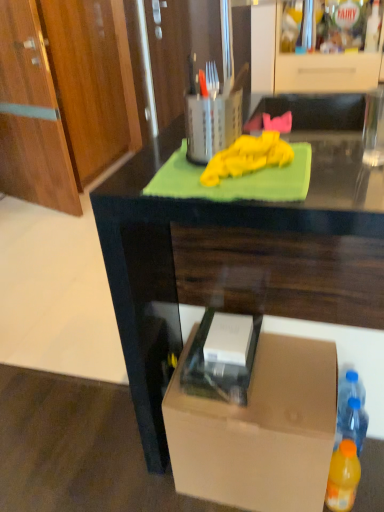
This screenshot has width=384, height=512. Find the location of `metallic silver utensil holder at upper center`. metallic silver utensil holder at upper center is located at coordinates (211, 124).

This screenshot has width=384, height=512. What do you see at coordinates (232, 261) in the screenshot?
I see `dark wood desk at center` at bounding box center [232, 261].

Measure the distance between point (107, 231) and camera.

Point (107, 231) is 33.50 inches away from camera.

Image resolution: width=384 pixels, height=512 pixels. What are the coordinates of `blue plastic bottle at lower right, acting as the 2th bottle starting from the front` in the screenshot? It's located at (351, 411).

Does point (218, 141) come farther from viewer compared to point (360, 382)?

No, it is in front of (360, 382).

Considering the positions of objects metallic silver utensil holder at upper center and blue plastic bottle at lower right, which ranks as the first bottle in back-to-front order, in the image provided, who is more to the left, metallic silver utensil holder at upper center or blue plastic bottle at lower right, which ranks as the first bottle in back-to-front order,?

metallic silver utensil holder at upper center is more to the left.

Is metallic silver utensil holder at upper center in contact with blue plastic bottle at lower right, acting as the 2th bottle starting from the front?

No, metallic silver utensil holder at upper center is not next to blue plastic bottle at lower right, acting as the 2th bottle starting from the front.

From a real-world perspective, is metallic silver utensil holder at upper center over blue plastic bottle at lower right, which ranks as the first bottle in back-to-front order?

Yes, from a real-world perspective, metallic silver utensil holder at upper center is over blue plastic bottle at lower right, which ranks as the first bottle in back-to-front order

Considering the relative sizes of brown cardboard box at lower right and matte wood cabinet at upper center in the image provided, is brown cardboard box at lower right wider than matte wood cabinet at upper center?

No, brown cardboard box at lower right is not wider than matte wood cabinet at upper center.

Is brown cardboard box at lower right positioned in front of matte wood cabinet at upper center?

Yes, the depth of brown cardboard box at lower right is less than that of matte wood cabinet at upper center.

Considering the relative sizes of brown cardboard box at lower right and matte wood cabinet at upper center in the image provided, is brown cardboard box at lower right taller than matte wood cabinet at upper center?

Incorrect, the height of brown cardboard box at lower right is not larger of that of matte wood cabinet at upper center.

Looking at this image, are matte wood cabinet at upper center and metallic silver utensil holder at upper center beside each other?

matte wood cabinet at upper center is not next to metallic silver utensil holder at upper center, and they're not touching.

From a real-world perspective, does matte wood cabinet at upper center sit lower than metallic silver utensil holder at upper center?

Yes, from a real-world perspective, matte wood cabinet at upper center is under metallic silver utensil holder at upper center.

How many degrees apart are the facing directions of matte wood cabinet at upper center and metallic silver utensil holder at upper center?

91 degrees.

Is matte wood cabinet at upper center positioned before metallic silver utensil holder at upper center?

No, matte wood cabinet at upper center is further to the viewer.

From the image's perspective, between matte wood cabinet at upper center and blue plastic bottle at lower right, which ranks as the first bottle in back-to-front order, who is located below?

From the image's view, blue plastic bottle at lower right, which ranks as the first bottle in back-to-front order, is below.

Does matte wood cabinet at upper center appear on the right side of blue plastic bottle at lower right, acting as the 2th bottle starting from the front?

Yes, matte wood cabinet at upper center is to the right of blue plastic bottle at lower right, acting as the 2th bottle starting from the front.

Is matte wood cabinet at upper center with blue plastic bottle at lower right, which ranks as the first bottle in back-to-front order?

matte wood cabinet at upper center is not next to blue plastic bottle at lower right, which ranks as the first bottle in back-to-front order, and they're not touching.

Is point (278, 41) closer or farther from the camera than point (345, 393)?

Point (278, 41) is farther from the camera than point (345, 393).

Considering the points (334, 475) and (147, 151), which point is behind, point (334, 475) or point (147, 151)?

Point (334, 475)

From the image's perspective, is orange plastic bottle at lower right, placed as the second bottle when sorted from back to front, located beneath dark wood desk at center?

Yes, from the image's perspective, orange plastic bottle at lower right, placed as the second bottle when sorted from back to front, is below dark wood desk at center.

From the image's perspective, which bottle is the 2nd one below the dark wood desk at center? Please provide its 2D coordinates.

[(343, 477)]

From a real-world perspective, is orange plastic bottle at lower right, placed as the second bottle when sorted from back to front, on dark wood desk at center?

No, from a real-world perspective, orange plastic bottle at lower right, placed as the second bottle when sorted from back to front, is not over dark wood desk at center

Is blue plastic bottle at lower right, acting as the 2th bottle starting from the front, at the back of orange plastic bottle at lower right, positioned as the 1th bottle in front-to-back order?

Absolutely, orange plastic bottle at lower right, positioned as the 1th bottle in front-to-back order, is directed away from blue plastic bottle at lower right, acting as the 2th bottle starting from the front.

Considering the relative sizes of orange plastic bottle at lower right, placed as the second bottle when sorted from back to front, and blue plastic bottle at lower right, which ranks as the first bottle in back-to-front order, in the image provided, is orange plastic bottle at lower right, placed as the second bottle when sorted from back to front, shorter than blue plastic bottle at lower right, which ranks as the first bottle in back-to-front order,?

No.

Which is in front, orange plastic bottle at lower right, placed as the second bottle when sorted from back to front, or blue plastic bottle at lower right, which ranks as the first bottle in back-to-front order?

orange plastic bottle at lower right, placed as the second bottle when sorted from back to front, is closer to the camera.

From the image's perspective, is orange plastic bottle at lower right, placed as the second bottle when sorted from back to front, on blue plastic bottle at lower right, which ranks as the first bottle in back-to-front order?

No.

From the picture: Can we say blue plastic bottle at lower right, acting as the 2th bottle starting from the front, lies outside brown cardboard box at lower right?

Yes, blue plastic bottle at lower right, acting as the 2th bottle starting from the front, is located beyond the bounds of brown cardboard box at lower right.

Between blue plastic bottle at lower right, acting as the 2th bottle starting from the front, and brown cardboard box at lower right, which one has smaller size?

blue plastic bottle at lower right, acting as the 2th bottle starting from the front.

Is blue plastic bottle at lower right, acting as the 2th bottle starting from the front, positioned in front of brown cardboard box at lower right?

No, blue plastic bottle at lower right, acting as the 2th bottle starting from the front, is further to the viewer.

There is a blue plastic bottle at lower right, acting as the 2th bottle starting from the front. Identify the location of appliance above it (from a real-world perspective). This screenshot has width=384, height=512. (211, 124).

I want to click on cabinetry above the brown cardboard box at lower right (from the image's perspective), so click(324, 70).

Looking at the image, which one is located further to orange plastic bottle at lower right, placed as the second bottle when sorted from back to front, brown cardboard box at lower right or dark wood desk at center?

dark wood desk at center is positioned further to the anchor orange plastic bottle at lower right, placed as the second bottle when sorted from back to front.

From the picture: Based on their spatial positions, is metallic silver utensil holder at upper center or blue plastic bottle at lower right, which ranks as the first bottle in back-to-front order, closer to matte wood cabinet at upper center?

Among the two, metallic silver utensil holder at upper center is located nearer to matte wood cabinet at upper center.

Which object lies nearer to the anchor point metallic silver utensil holder at upper center, brown cardboard box at lower right or orange plastic bottle at lower right, placed as the second bottle when sorted from back to front?

The object closer to metallic silver utensil holder at upper center is brown cardboard box at lower right.

From the image, which object appears to be nearer to dark wood desk at center, orange plastic bottle at lower right, positioned as the 1th bottle in front-to-back order, or matte wood cabinet at upper center?

orange plastic bottle at lower right, positioned as the 1th bottle in front-to-back order, is positioned closer to the anchor dark wood desk at center.

Looking at the image, which one is located further to brown cardboard box at lower right, metallic silver utensil holder at upper center or dark wood desk at center?

Among the two, metallic silver utensil holder at upper center is located further to brown cardboard box at lower right.

Looking at the image, which one is located further to orange plastic bottle at lower right, positioned as the 1th bottle in front-to-back order, dark wood desk at center or blue plastic bottle at lower right, which ranks as the first bottle in back-to-front order?

dark wood desk at center.

Estimate the real-world distances between objects in this image. Which object is closer to blue plastic bottle at lower right, acting as the 2th bottle starting from the front, orange plastic bottle at lower right, placed as the second bottle when sorted from back to front, or metallic silver utensil holder at upper center?

orange plastic bottle at lower right, placed as the second bottle when sorted from back to front.

Estimate the real-world distances between objects in this image. Which object is further from dark wood desk at center, metallic silver utensil holder at upper center or matte wood cabinet at upper center?

matte wood cabinet at upper center is positioned further to the anchor dark wood desk at center.

At what (x,y) coordinates should I click in order to perform the action: click on appliance between matte wood cabinet at upper center and blue plastic bottle at lower right, acting as the 2th bottle starting from the front, vertically. Please return your answer as a coordinate pair (x, y). Looking at the image, I should click on (211, 124).

This screenshot has height=512, width=384. Identify the location of bottle that lies between metallic silver utensil holder at upper center and orange plastic bottle at lower right, positioned as the 1th bottle in front-to-back order, from top to bottom. (351, 411).

I want to click on box between metallic silver utensil holder at upper center and orange plastic bottle at lower right, positioned as the 1th bottle in front-to-back order, from top to bottom, so click(x=259, y=430).

Find the location of a particular element. bottle positioned between dark wood desk at center and blue plastic bottle at lower right, which ranks as the first bottle in back-to-front order, from near to far is located at coordinates (343, 477).